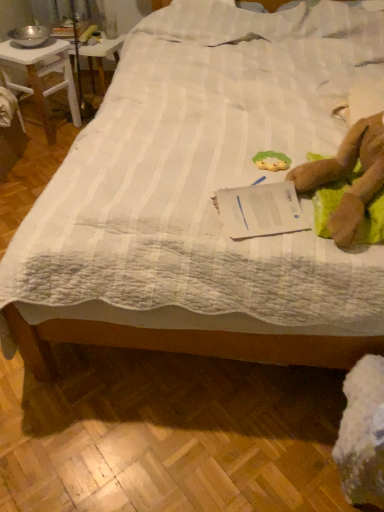
Question: Is green fabric toy at center situated inside white paper at center or outside?

Choices:
 (A) inside
 (B) outside

Answer: (B)

Question: In terms of width, does green fabric toy at center look wider or thinner when compared to white paper at center?

Choices:
 (A) wide
 (B) thin

Answer: (B)

Question: Which of these objects is positioned closest to the white wood desk at upper left?

Choices:
 (A) metallic silver bowl at upper left
 (B) brown plush toy at right
 (C) green fabric toy at center
 (D) white quilted bed at center
 (E) white paper at center

Answer: (A)

Question: Considering the real-world distances, which object is closest to the white wood desk at upper left?

Choices:
 (A) green fabric toy at center
 (B) white quilted bed at center
 (C) white paper at center
 (D) metallic silver bowl at upper left
 (E) brown plush toy at right

Answer: (D)